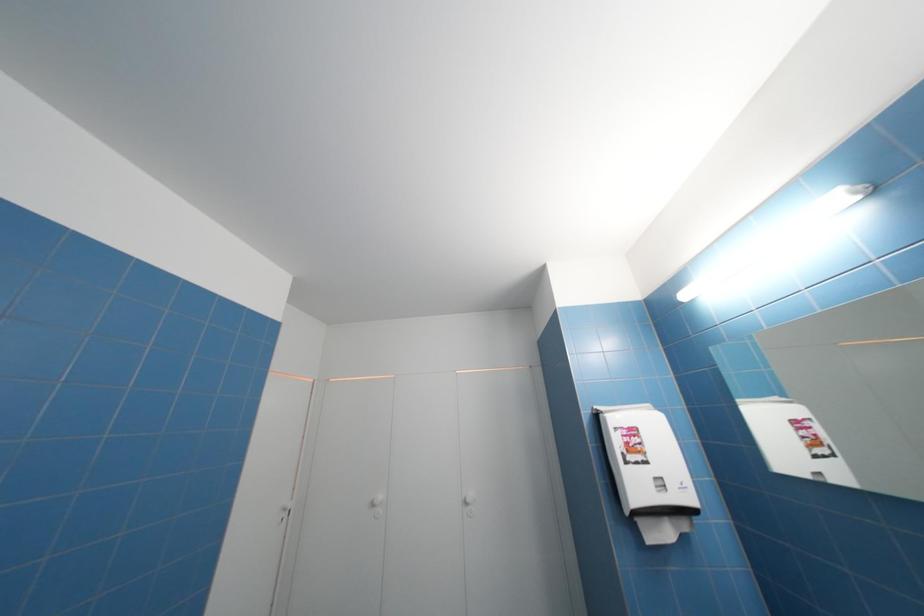
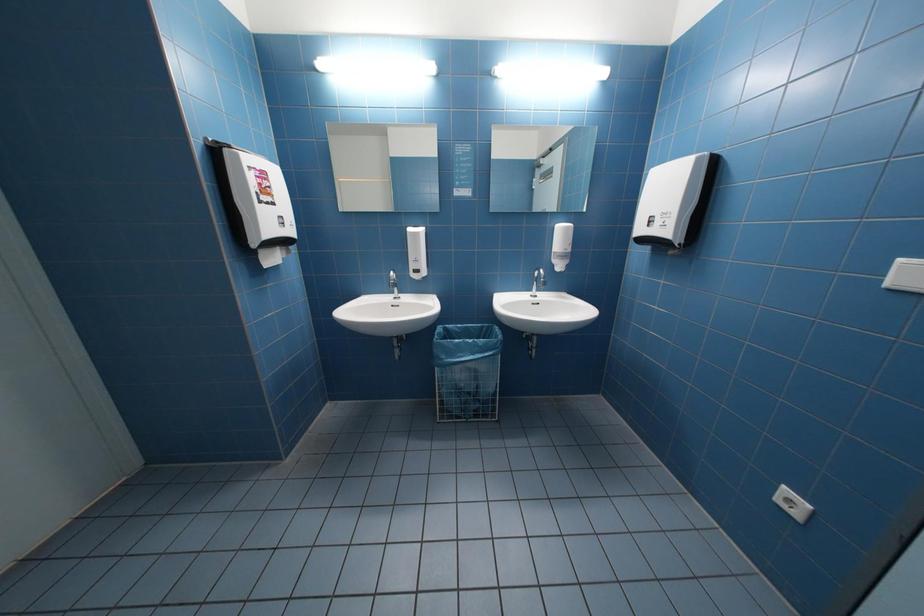
Question: The first image is from the beginning of the video and the second image is from the end. How did the camera likely rotate when shooting the video?

Choices:
 (A) Left
 (B) Right
 (C) Up
 (D) Down

Answer: (B)